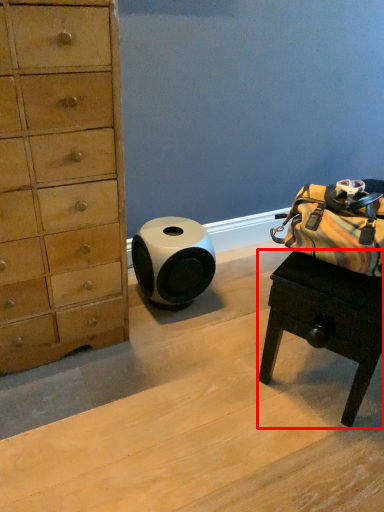
Question: From the image's perspective, where is desk (annotated by the red box) located relative to speaker?

Choices:
 (A) above
 (B) below

Answer: (B)